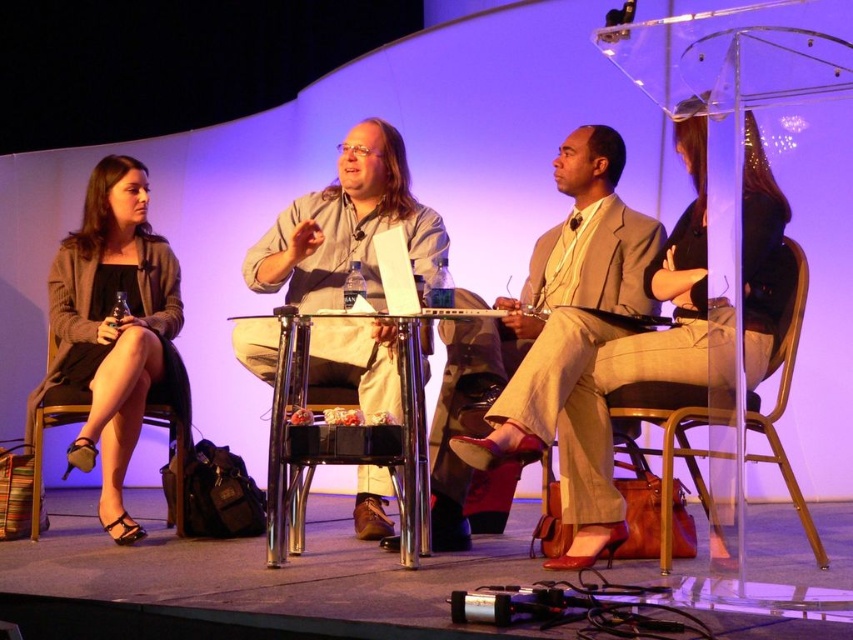
Question: Among these objects, which one is farthest from the camera?

Choices:
 (A) metallic silver chair at center
 (B) light beige suit at center
 (C) light beige cotton shirt at center

Answer: (B)

Question: Is metallic gold chair at right below black leather chair at lower left?

Choices:
 (A) no
 (B) yes

Answer: (A)

Question: Which object is the farthest from the light beige suit at center?

Choices:
 (A) metallic silver chair at center
 (B) black leather chair at lower left
 (C) metallic gold chair at right
 (D) light beige cotton shirt at center

Answer: (B)

Question: Can you confirm if light beige suit at center is positioned to the right of black leather chair at lower left?

Choices:
 (A) yes
 (B) no

Answer: (A)

Question: Among these points, which one is nearest to the camera?

Choices:
 (A) (514, 422)
 (B) (183, 426)
 (C) (619, 387)
 (D) (291, 378)

Answer: (A)

Question: Is light beige suit at center positioned before light beige cotton shirt at center?

Choices:
 (A) no
 (B) yes

Answer: (A)